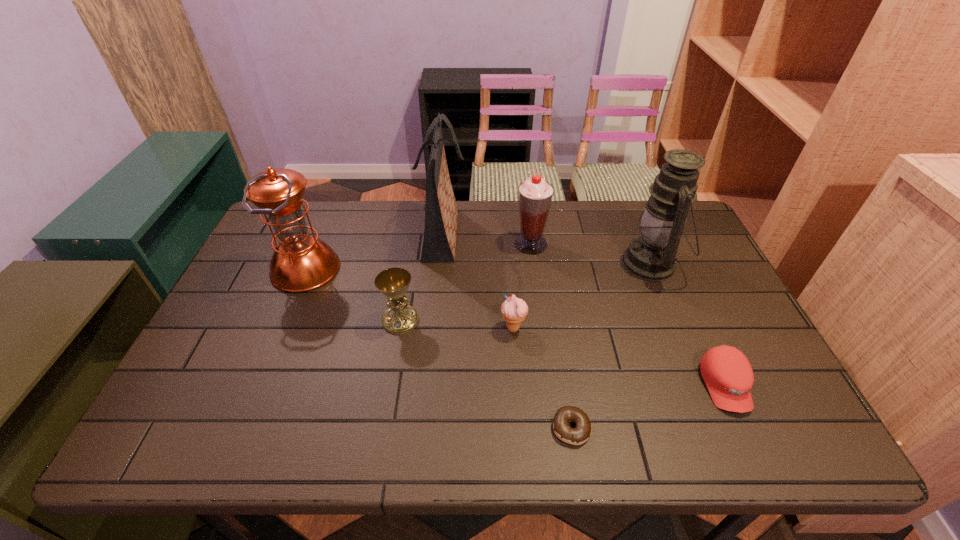
The height and width of the screenshot is (540, 960). What are the coordinates of `vacant space that is in between the right oil lamp and the icecream` in the screenshot? It's located at (583, 296).

Find the location of `vacant point located between the chalice and the seventh tallest object`. vacant point located between the chalice and the seventh tallest object is located at coordinates (563, 353).

This screenshot has width=960, height=540. In order to click on empty space between the icecream and the chalice in this screenshot , I will do `click(457, 324)`.

The image size is (960, 540). I want to click on free space between the cap and the smoothie, so click(628, 315).

This screenshot has width=960, height=540. I want to click on vacant region between the doughnut and the smoothie, so click(551, 336).

Find the location of a particular element. Image resolution: width=960 pixels, height=540 pixels. free space between the second shortest object and the smoothie is located at coordinates (628, 315).

The width and height of the screenshot is (960, 540). What are the coordinates of `vacant space that is in between the chalice and the cap` in the screenshot? It's located at (563, 353).

Locate an element on the screen. empty space between the fifth shortest object and the seventh tallest object is located at coordinates (628, 315).

Where is `vacant area that lies between the chalice and the second shortest object`? vacant area that lies between the chalice and the second shortest object is located at coordinates (563, 353).

The width and height of the screenshot is (960, 540). Find the location of `vacant area that lies between the shopping bag and the smoothie`. vacant area that lies between the shopping bag and the smoothie is located at coordinates (487, 239).